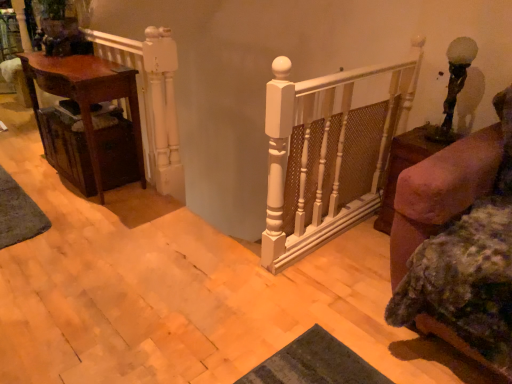
Question: Does green textured mat at lower left appear on the right side of matte brown table at left?

Choices:
 (A) no
 (B) yes

Answer: (A)

Question: Is green textured mat at lower left bigger than matte brown table at left?

Choices:
 (A) yes
 (B) no

Answer: (B)

Question: Is the surface of green textured mat at lower left in direct contact with matte brown table at left?

Choices:
 (A) yes
 (B) no

Answer: (B)

Question: Is green textured mat at lower left completely or partially outside of matte brown table at left?

Choices:
 (A) yes
 (B) no

Answer: (A)

Question: Does green textured mat at lower left have a lesser width compared to matte brown table at left?

Choices:
 (A) yes
 (B) no

Answer: (A)

Question: Does green textured mat at lower left appear on the left side of matte brown table at left?

Choices:
 (A) yes
 (B) no

Answer: (A)

Question: Can you confirm if white painted wood railing at upper left is taller than green textured mat at lower left?

Choices:
 (A) no
 (B) yes

Answer: (B)

Question: Is white painted wood railing at upper left outside of green textured mat at lower left?

Choices:
 (A) no
 (B) yes

Answer: (B)

Question: Is white painted wood railing at upper left beside green textured mat at lower left?

Choices:
 (A) yes
 (B) no

Answer: (B)

Question: Does white painted wood railing at upper left come in front of green textured mat at lower left?

Choices:
 (A) yes
 (B) no

Answer: (A)

Question: Does white painted wood railing at upper left have a larger size compared to green textured mat at lower left?

Choices:
 (A) no
 (B) yes

Answer: (B)

Question: Does white painted wood railing at upper left have a greater width compared to green textured mat at lower left?

Choices:
 (A) no
 (B) yes

Answer: (A)

Question: Is brown wooden side table at right completely or partially outside of woven brown drawer at left?

Choices:
 (A) yes
 (B) no

Answer: (A)